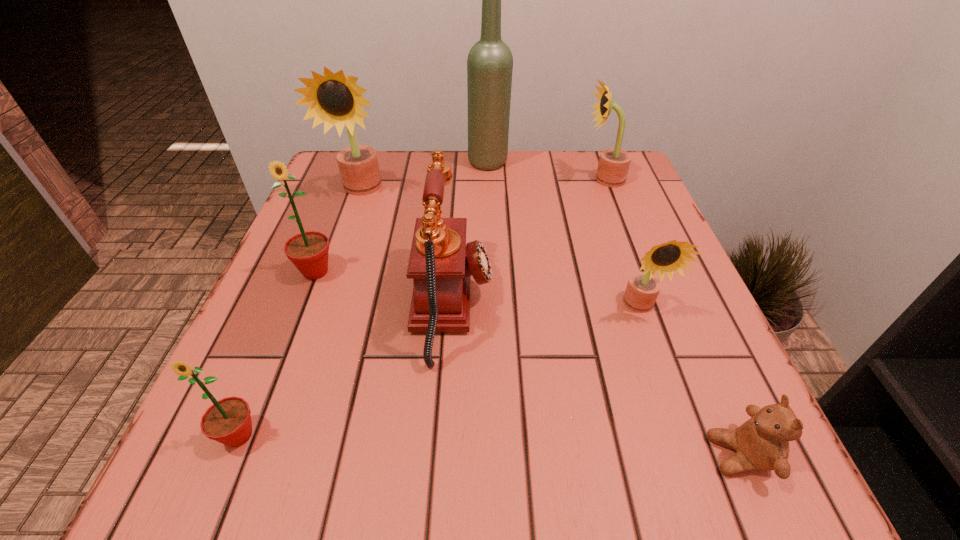
Locate an element on the screen. The image size is (960, 540). wine bottle is located at coordinates [490, 62].

This screenshot has width=960, height=540. In order to click on green wine bottle in this screenshot , I will do `click(490, 62)`.

I want to click on the second tallest object, so click(335, 99).

Image resolution: width=960 pixels, height=540 pixels. I want to click on the tallest sunflower, so click(335, 99).

The height and width of the screenshot is (540, 960). Identify the location of the second smallest yellow sunflower. (614, 163).

Locate an element on the screen. the third farthest sunflower is located at coordinates (308, 251).

You are a GUI agent. You are given a task and a screenshot of the screen. Output one action in this format:
    pyautogui.click(x=<x>, y=<y>)
    Task: Click on the bigger green sunflower
    The height and width of the screenshot is (540, 960).
    Given the screenshot: What is the action you would take?
    pyautogui.click(x=308, y=251)

The width and height of the screenshot is (960, 540). In order to click on telephone in this screenshot , I will do `click(441, 263)`.

You are a GUI agent. You are given a task and a screenshot of the screen. Output one action in this format:
    pyautogui.click(x=<x>, y=<y>)
    Task: Click on the second nearest sunflower
    The width and height of the screenshot is (960, 540).
    Given the screenshot: What is the action you would take?
    pyautogui.click(x=642, y=290)

The height and width of the screenshot is (540, 960). I want to click on the smallest yellow sunflower, so click(642, 290).